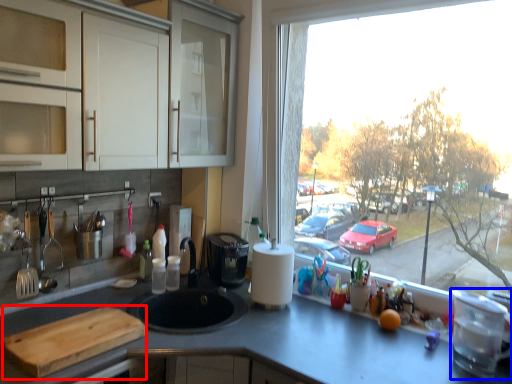
Question: Which of the following is the farthest to the observer, cutting board (highlighted by a red box) or appliance (highlighted by a blue box)?

Choices:
 (A) cutting board
 (B) appliance

Answer: (B)